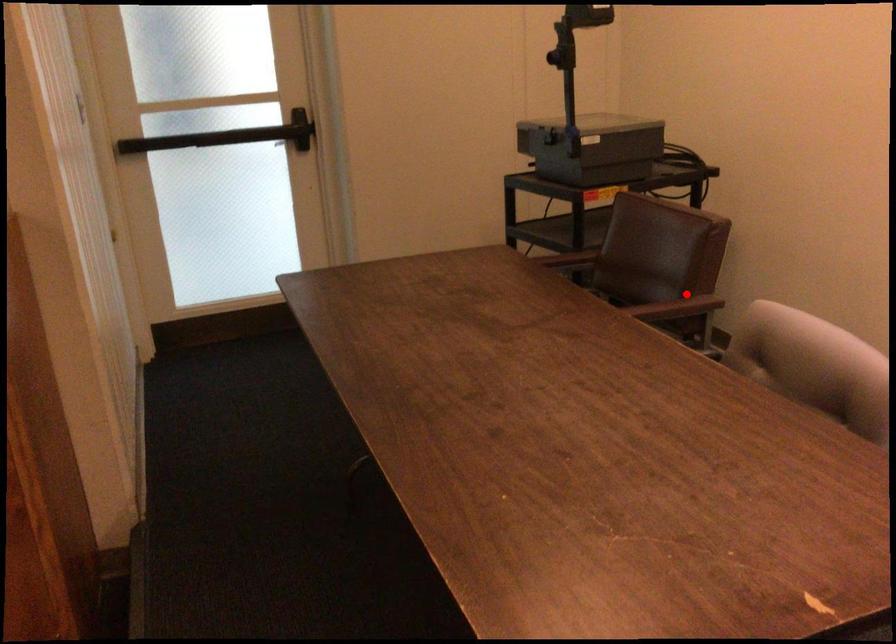
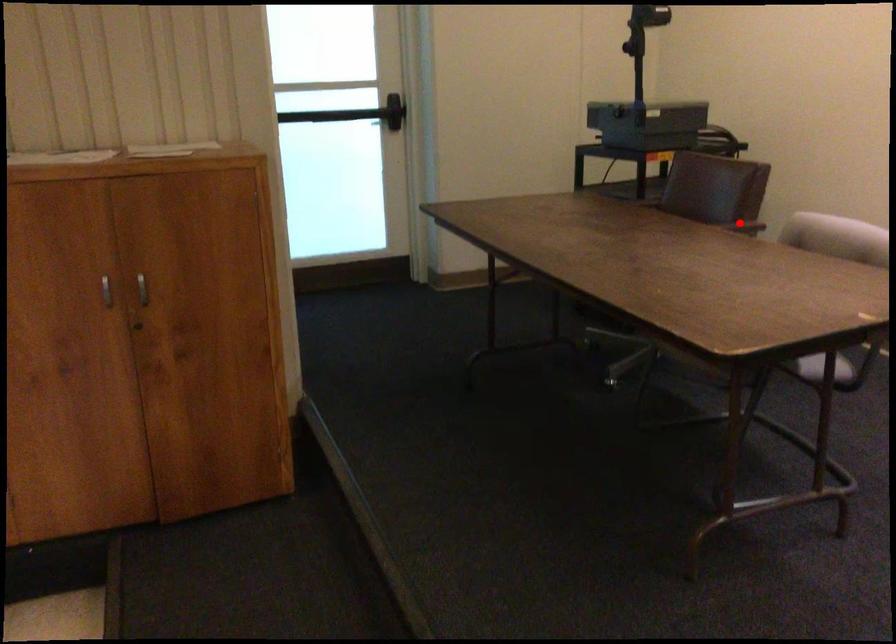
I am providing you with two images of the same scene from different viewpoints. A red point is marked on the first image and another point is marked on the second image. Does the point marked in image1 correspond to the same location as the one in image2?

Yes